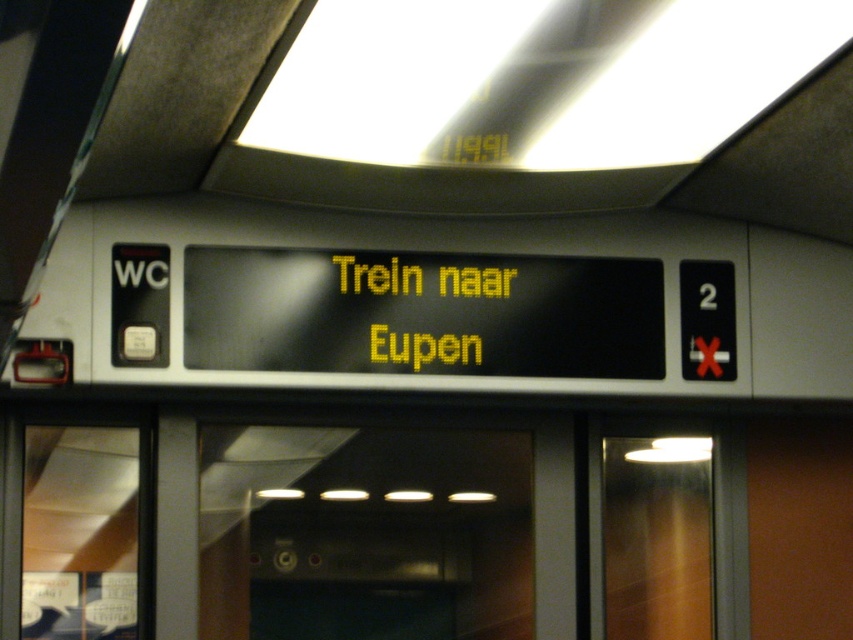
Is transparent glass door at center to the left of yellow led text at center from the viewer's perspective?

Correct, you'll find transparent glass door at center to the left of yellow led text at center.

Locate an element on the screen. transparent glass door at center is located at coordinates (364, 532).

Image resolution: width=853 pixels, height=640 pixels. In order to click on transparent glass door at center in this screenshot , I will do `click(364, 532)`.

Is point (396, 470) farther from viewer compared to point (669, 432)?

No.

Identify the location of transparent glass door at center. (364, 532).

Who is shorter, transparent glass door at right or yellow led text at center?

yellow led text at center is shorter.

The height and width of the screenshot is (640, 853). What do you see at coordinates (654, 534) in the screenshot? I see `transparent glass door at right` at bounding box center [654, 534].

Is point (641, 564) more distant than point (467, 355)?

Yes, point (641, 564) is farther from viewer.

I want to click on transparent glass door at right, so click(x=654, y=534).